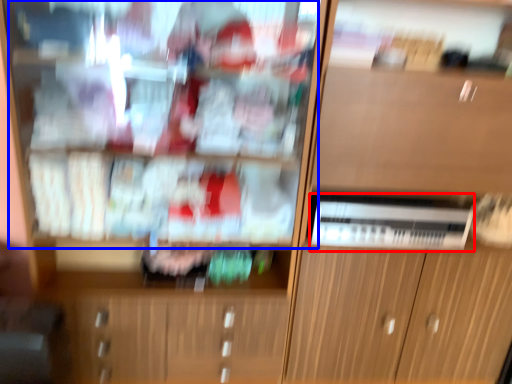
Question: Which of the following is the closest to the observer, appliance (highlighted by a red box) or shelf (highlighted by a blue box)?

Choices:
 (A) appliance
 (B) shelf

Answer: (B)